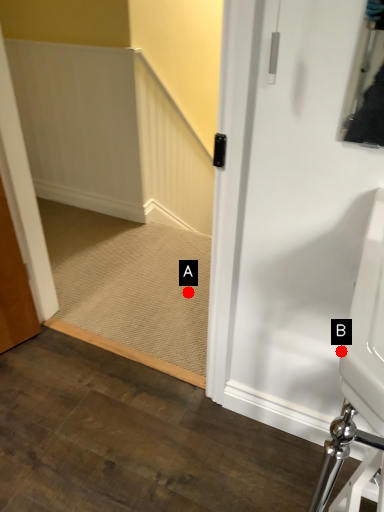
Question: Two points are circled on the image, labeled by A and B beside each circle. Which point is closer to the camera?

Choices:
 (A) A is closer
 (B) B is closer

Answer: (B)